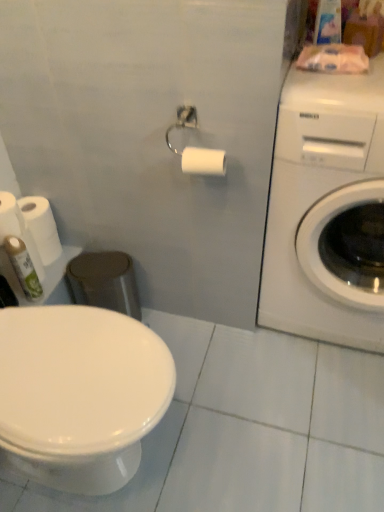
Question: Should I look upward or downward to see white matte toilet paper at upper center, the fourth toilet paper when ordered from back to front?

Choices:
 (A) down
 (B) up

Answer: (B)

Question: From a real-world perspective, is green matte spray can at lower left positioned under white glossy toilet at lower left based on gravity?

Choices:
 (A) no
 (B) yes

Answer: (B)

Question: Is there a large distance between green matte spray can at lower left and white glossy toilet at lower left?

Choices:
 (A) no
 (B) yes

Answer: (A)

Question: Is green matte spray can at lower left surrounding white glossy toilet at lower left?

Choices:
 (A) yes
 (B) no

Answer: (B)

Question: Is green matte spray can at lower left facing towards white glossy toilet at lower left?

Choices:
 (A) no
 (B) yes

Answer: (A)

Question: Does green matte spray can at lower left have a lesser height compared to white glossy toilet at lower left?

Choices:
 (A) no
 (B) yes

Answer: (B)

Question: Is green matte spray can at lower left behind white glossy toilet at lower left?

Choices:
 (A) yes
 (B) no

Answer: (A)

Question: Can you confirm if white matte toilet paper at left, the 2th toilet paper viewed from the right, is wider than white matte toilet paper at left, which appears as the third toilet paper when viewed from the back?

Choices:
 (A) yes
 (B) no

Answer: (A)

Question: Can we say white matte toilet paper at left, the 2th toilet paper viewed from the right, lies outside white matte toilet paper at left, which ranks as the second toilet paper in front-to-back order?

Choices:
 (A) no
 (B) yes

Answer: (B)

Question: Is white matte toilet paper at left, the 2th toilet paper viewed from the right, oriented away from white matte toilet paper at left, which appears as the third toilet paper when viewed from the back?

Choices:
 (A) no
 (B) yes

Answer: (A)

Question: Can white matte toilet paper at left, which appears as the third toilet paper when viewed from the back, be found inside white matte toilet paper at left, the first toilet paper from the back?

Choices:
 (A) no
 (B) yes

Answer: (A)

Question: Can you confirm if white matte toilet paper at left, the first toilet paper from the back, is taller than white matte toilet paper at left, which ranks as the second toilet paper in front-to-back order?

Choices:
 (A) no
 (B) yes

Answer: (A)

Question: Considering the relative positions of white matte toilet paper at left, the 2th toilet paper viewed from the right, and white matte toilet paper at left, which is the 1th toilet paper in left-to-right order, in the image provided, is white matte toilet paper at left, the 2th toilet paper viewed from the right, in front of white matte toilet paper at left, which is the 1th toilet paper in left-to-right order,?

Choices:
 (A) no
 (B) yes

Answer: (A)

Question: Does white glossy washing machine at upper right come in front of white matte toilet paper at left, placed as the 3th toilet paper when sorted from right to left?

Choices:
 (A) no
 (B) yes

Answer: (B)